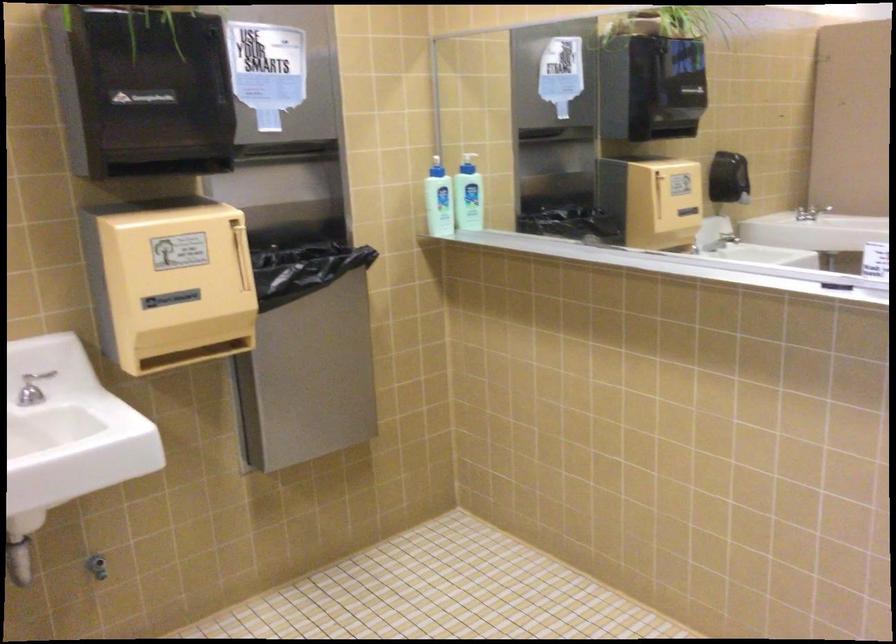
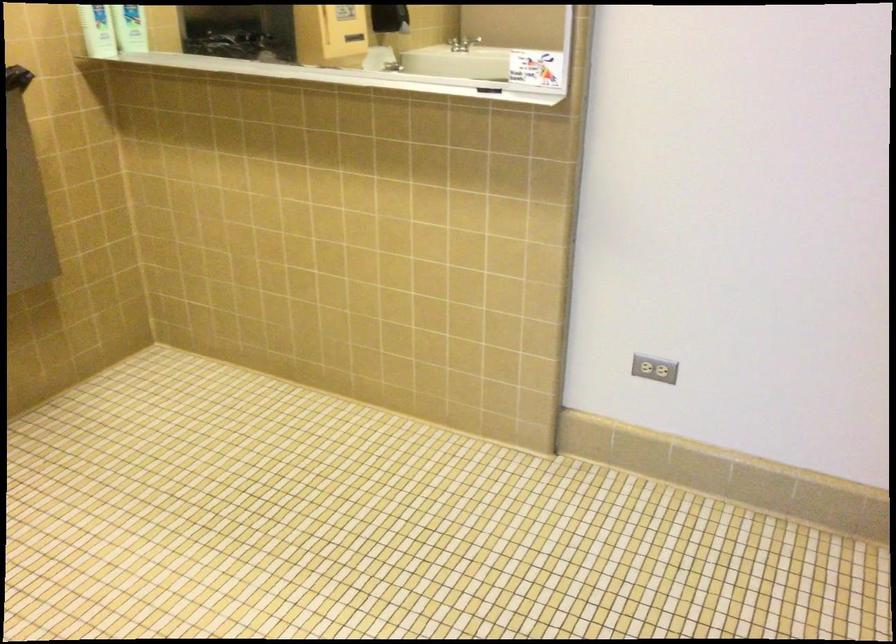
Locate, in the second image, the point that corresponds to point 471,205 in the first image.

(131, 28)